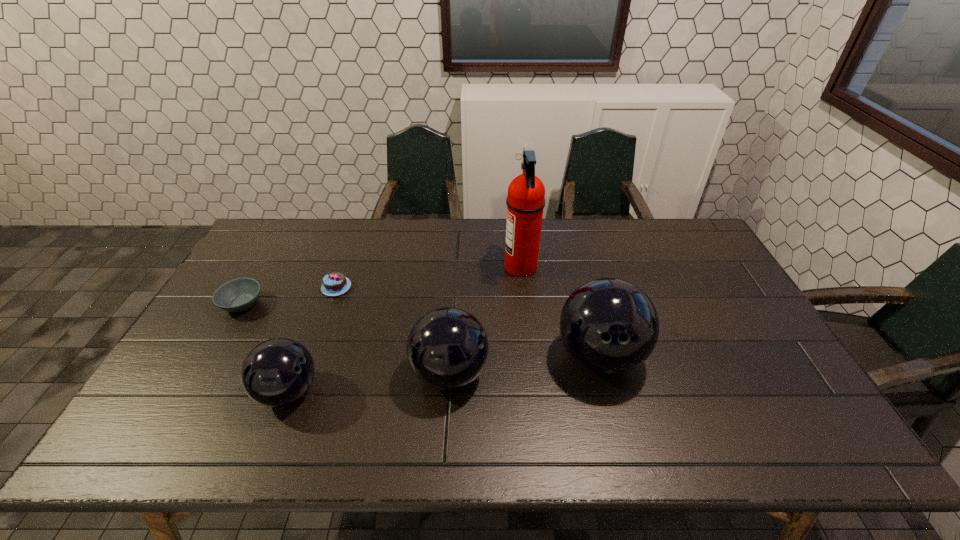
Where is `the shortest bowling ball`? Image resolution: width=960 pixels, height=540 pixels. the shortest bowling ball is located at coordinates (277, 372).

Locate an element on the screen. Image resolution: width=960 pixels, height=540 pixels. the fourth tallest object is located at coordinates pos(277,372).

You are a GUI agent. You are given a task and a screenshot of the screen. Output one action in this format:
    pyautogui.click(x=<x>, y=<y>)
    Task: Click on the second bowling ball from right to left
    This screenshot has width=960, height=540.
    Given the screenshot: What is the action you would take?
    pyautogui.click(x=447, y=348)

Image resolution: width=960 pixels, height=540 pixels. I want to click on the fourth shortest object, so click(447, 348).

I want to click on the tallest bowling ball, so click(610, 326).

I want to click on the second tallest object, so [x=610, y=326].

Find the location of a particular element. The height and width of the screenshot is (540, 960). chocolate cake is located at coordinates (334, 284).

Identify the location of the fifth object from left to right. (525, 202).

Where is `the tallest object`? the tallest object is located at coordinates (525, 202).

At what (x,y) coordinates should I click in order to perform the action: click on soup bowl. Please return your answer as a coordinate pair (x, y). This screenshot has width=960, height=540. Looking at the image, I should click on (237, 295).